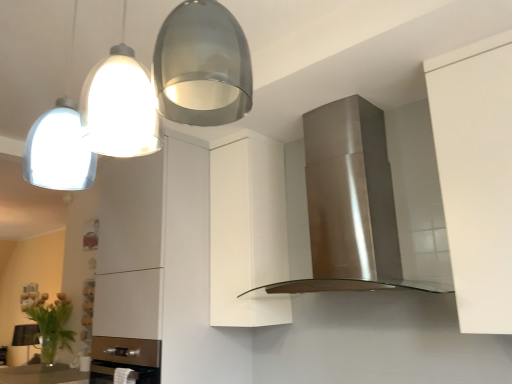
The width and height of the screenshot is (512, 384). What do you see at coordinates (145, 97) in the screenshot? I see `satin silver pendant lights at upper left` at bounding box center [145, 97].

I want to click on green leafy plant at lower left, so click(x=52, y=325).

The width and height of the screenshot is (512, 384). Describe the element at coordinates (247, 231) in the screenshot. I see `white matte cabinet at center` at that location.

Image resolution: width=512 pixels, height=384 pixels. I want to click on white matte cabinet at center, so click(x=247, y=231).

I want to click on satin silver pendant lights at upper left, so click(x=145, y=97).

Which object is more forward, white matte cabinet at center or satin silver pendant lights at upper left?

Positioned in front is satin silver pendant lights at upper left.

Would you consider white matte cabinet at center to be distant from satin silver pendant lights at upper left?

white matte cabinet at center is positioned a significant distance from satin silver pendant lights at upper left.

Between white matte cabinet at center and satin silver pendant lights at upper left, which one appears on the left side from the viewer's perspective?

Positioned to the left is satin silver pendant lights at upper left.

In the scene shown: Which is nearer, (237, 104) or (246, 201)?

The point (237, 104) is in front.

Can you tell me how much satin silver pendant lights at upper left and white matte cabinet at center differ in facing direction?

satin silver pendant lights at upper left and white matte cabinet at center are facing 89.1 degrees away from each other.

From the picture: Does satin silver pendant lights at upper left come behind white matte cabinet at center?

No, satin silver pendant lights at upper left is closer to the viewer.

Can you confirm if satin silver pendant lights at upper left is wider than white matte cabinet at center?

Yes, satin silver pendant lights at upper left is wider than white matte cabinet at center.

Could you tell me if stainless steel range hood at center is facing white matte cabinet at center?

No, stainless steel range hood at center is not turned towards white matte cabinet at center.

The image size is (512, 384). I want to click on home appliance above the white matte cabinet at center (from the image's perspective), so click(351, 203).

Does stainless steel range hood at center have a lesser height compared to white matte cabinet at center?

Yes.

Can you confirm if stainless steel range hood at center is bigger than white matte cabinet at center?

Yes, stainless steel range hood at center is bigger than white matte cabinet at center.

Identify the location of light fixture above the stainless steel range hood at center (from the image's perspective). (145, 97).

Is the depth of stainless steel range hood at center less than that of satin silver pendant lights at upper left?

No, stainless steel range hood at center is behind satin silver pendant lights at upper left.

Which object is wider, stainless steel range hood at center or satin silver pendant lights at upper left?

satin silver pendant lights at upper left is wider.

Does stainless steel range hood at center have a greater height compared to satin silver pendant lights at upper left?

Correct, stainless steel range hood at center is much taller as satin silver pendant lights at upper left.

Looking at this image, is stainless steel range hood at center thinner than green leafy plant at lower left?

Incorrect, the width of stainless steel range hood at center is not less than that of green leafy plant at lower left.

Could you tell me if stainless steel range hood at center is facing green leafy plant at lower left?

No, stainless steel range hood at center is not turned towards green leafy plant at lower left.

From a real-world perspective, who is located higher, stainless steel range hood at center or green leafy plant at lower left?

stainless steel range hood at center, from a real-world perspective.

From the image's perspective, would you say stainless steel range hood at center is positioned over green leafy plant at lower left?

Yes, from the image's perspective, stainless steel range hood at center is above green leafy plant at lower left.

Is white matte cabinet at center spatially inside green leafy plant at lower left, or outside of it?

white matte cabinet at center cannot be found inside green leafy plant at lower left.

Is white matte cabinet at center in front of or behind green leafy plant at lower left in the image?

Visually, white matte cabinet at center is located in front of green leafy plant at lower left.

Can you confirm if white matte cabinet at center is smaller than green leafy plant at lower left?

Actually, white matte cabinet at center might be larger than green leafy plant at lower left.

Which object is positioned more to the left, white matte cabinet at center or green leafy plant at lower left?

green leafy plant at lower left is more to the left.

Is satin silver pendant lights at upper left turned away from green leafy plant at lower left?

No, satin silver pendant lights at upper left's orientation is not away from green leafy plant at lower left.

Which of these two, satin silver pendant lights at upper left or green leafy plant at lower left, is smaller?

green leafy plant at lower left.

Looking at this image, from the image's perspective, between satin silver pendant lights at upper left and green leafy plant at lower left, who is located below?

green leafy plant at lower left, from the image's perspective.

Locate an element on the screen. cabinetry below the satin silver pendant lights at upper left (from a real-world perspective) is located at coordinates (247, 231).

In order to click on cabinetry on the right side of satin silver pendant lights at upper left in this screenshot , I will do `click(247, 231)`.

In the scene shown: Considering their positions, is white matte cabinet at center positioned further to stainless steel range hood at center than satin silver pendant lights at upper left?

satin silver pendant lights at upper left is further to stainless steel range hood at center.

Which object lies nearer to the anchor point white matte cabinet at center, satin silver pendant lights at upper left or stainless steel range hood at center?

Among the two, stainless steel range hood at center is located nearer to white matte cabinet at center.

Based on their spatial positions, is stainless steel range hood at center or satin silver pendant lights at upper left closer to white matte cabinet at center?

stainless steel range hood at center is closer to white matte cabinet at center.

Estimate the real-world distances between objects in this image. Which object is further from green leafy plant at lower left, stainless steel range hood at center or white matte cabinet at center?

Based on the image, stainless steel range hood at center appears to be further to green leafy plant at lower left.

Estimate the real-world distances between objects in this image. Which object is closer to green leafy plant at lower left, white matte cabinet at center or satin silver pendant lights at upper left?

Based on the image, white matte cabinet at center appears to be nearer to green leafy plant at lower left.

Based on their spatial positions, is green leafy plant at lower left or stainless steel range hood at center further from white matte cabinet at center?

green leafy plant at lower left is positioned further to the anchor white matte cabinet at center.

Looking at the image, which one is located further to green leafy plant at lower left, white matte cabinet at center or stainless steel range hood at center?

The object further to green leafy plant at lower left is stainless steel range hood at center.

Looking at this image, when comparing their distances from satin silver pendant lights at upper left, does white matte cabinet at center or green leafy plant at lower left seem further?

green leafy plant at lower left is further to satin silver pendant lights at upper left.

In order to click on cabinetry located between green leafy plant at lower left and stainless steel range hood at center in the left-right direction in this screenshot , I will do `click(247, 231)`.

Image resolution: width=512 pixels, height=384 pixels. Find the location of `cabinetry between satin silver pendant lights at upper left and green leafy plant at lower left in the front-back direction`. cabinetry between satin silver pendant lights at upper left and green leafy plant at lower left in the front-back direction is located at coordinates (247, 231).

At what (x,y) coordinates should I click in order to perform the action: click on home appliance between satin silver pendant lights at upper left and green leafy plant at lower left along the z-axis. Please return your answer as a coordinate pair (x, y). Image resolution: width=512 pixels, height=384 pixels. Looking at the image, I should click on (351, 203).

The height and width of the screenshot is (384, 512). What are the coordinates of `home appliance between satin silver pendant lights at upper left and white matte cabinet at center along the z-axis` in the screenshot? It's located at (351, 203).